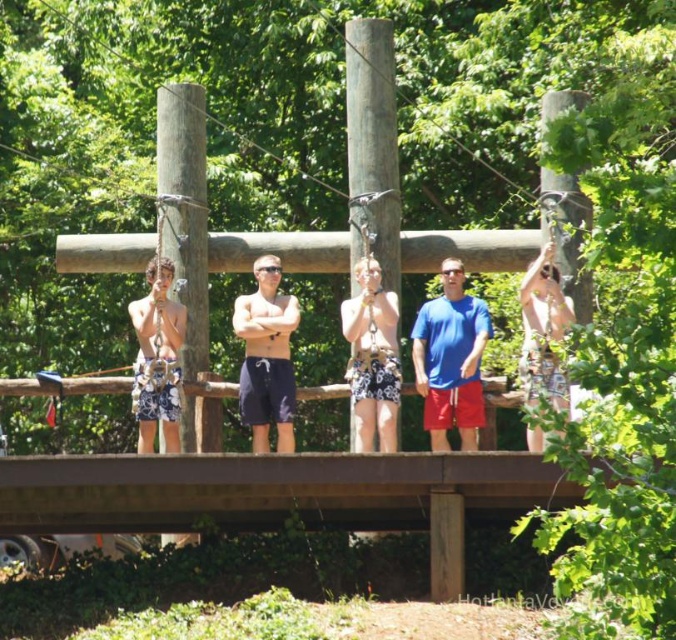
Is the position of blue fabric shirt at center less distant than that of white cotton shorts at left?

No, it is not.

I want to click on blue fabric shirt at center, so click(x=450, y=358).

The width and height of the screenshot is (676, 640). Describe the element at coordinates (450, 358) in the screenshot. I see `blue fabric shirt at center` at that location.

This screenshot has height=640, width=676. Identify the location of blue fabric shirt at center. (450, 358).

You are a GUI agent. You are given a task and a screenshot of the screen. Output one action in this format:
    pyautogui.click(x=<x>, y=<y>)
    Task: Click on the dark blue swim trunks at center
    This screenshot has width=676, height=640.
    Given the screenshot: What is the action you would take?
    pyautogui.click(x=266, y=356)

Does dark blue swim trunks at center have a lesser height compared to camouflage shorts at right?

Yes, dark blue swim trunks at center is shorter than camouflage shorts at right.

The width and height of the screenshot is (676, 640). In order to click on dark blue swim trunks at center in this screenshot , I will do click(x=266, y=356).

Image resolution: width=676 pixels, height=640 pixels. I want to click on dark blue swim trunks at center, so click(x=266, y=356).

Does point (164, 99) lie in front of point (180, 333)?

That is False.

Does brown wood pole at left have a lesser height compared to white cotton shorts at left?

No.

Is point (158, 152) in front of point (149, 305)?

No, (158, 152) is behind (149, 305).

Find the location of a particular element. brown wood pole at left is located at coordinates (185, 211).